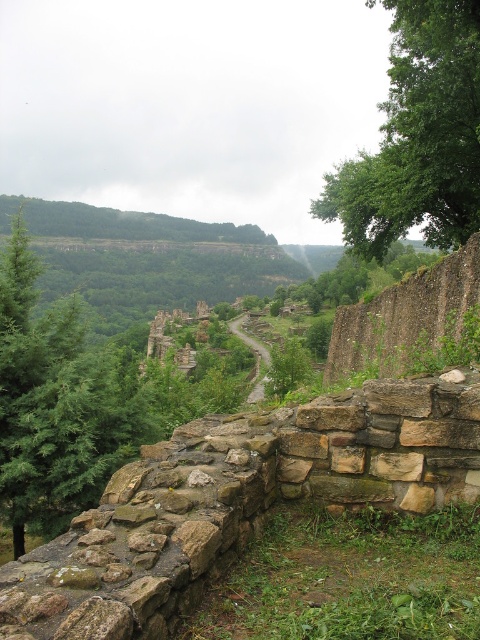
Question: Does green leafy tree at upper right have a larger size compared to brown stone path at center?

Choices:
 (A) no
 (B) yes

Answer: (A)

Question: Which object appears farthest from the camera in this image?

Choices:
 (A) green leafy tree at upper right
 (B) brown stone path at center

Answer: (B)

Question: Which point is farther from the camera taking this photo?

Choices:
 (A) tap(265, 362)
 (B) tap(422, 125)

Answer: (A)

Question: Does green leafy tree at upper right appear on the left side of brown stone path at center?

Choices:
 (A) yes
 (B) no

Answer: (B)

Question: Which of the following is the closest to the observer?

Choices:
 (A) (259, 371)
 (B) (347, 204)

Answer: (B)

Question: Does green leafy tree at upper right come in front of brown stone path at center?

Choices:
 (A) yes
 (B) no

Answer: (A)